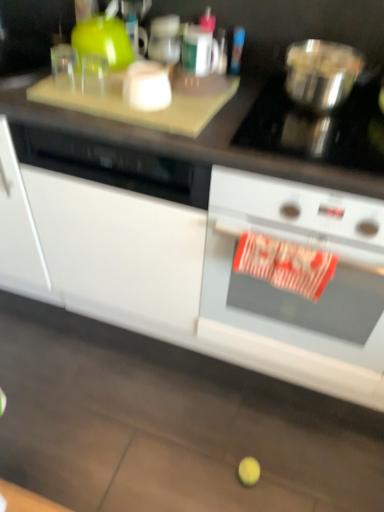
Where is `vacant area to the left of metallic silver bowl at upper right`? This screenshot has width=384, height=512. vacant area to the left of metallic silver bowl at upper right is located at coordinates click(252, 102).